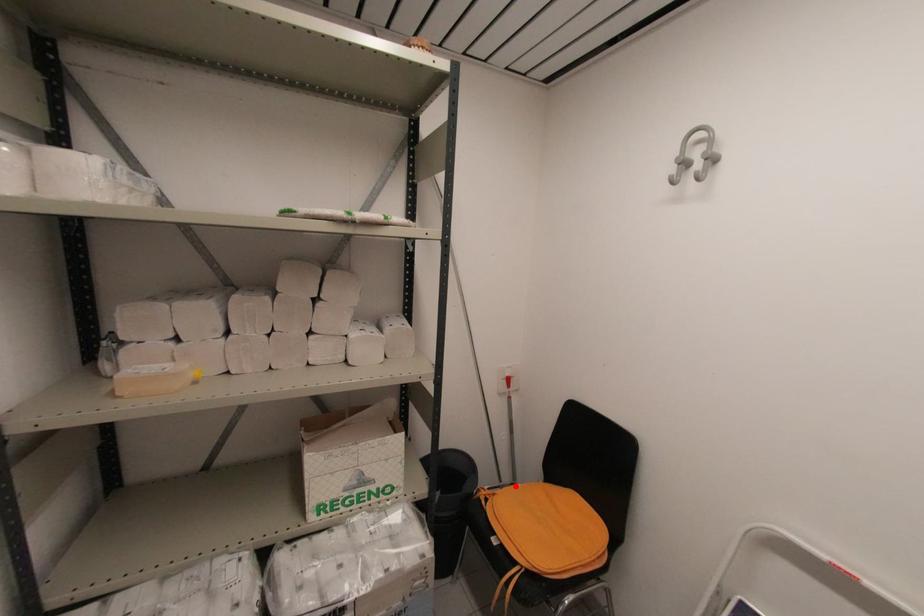
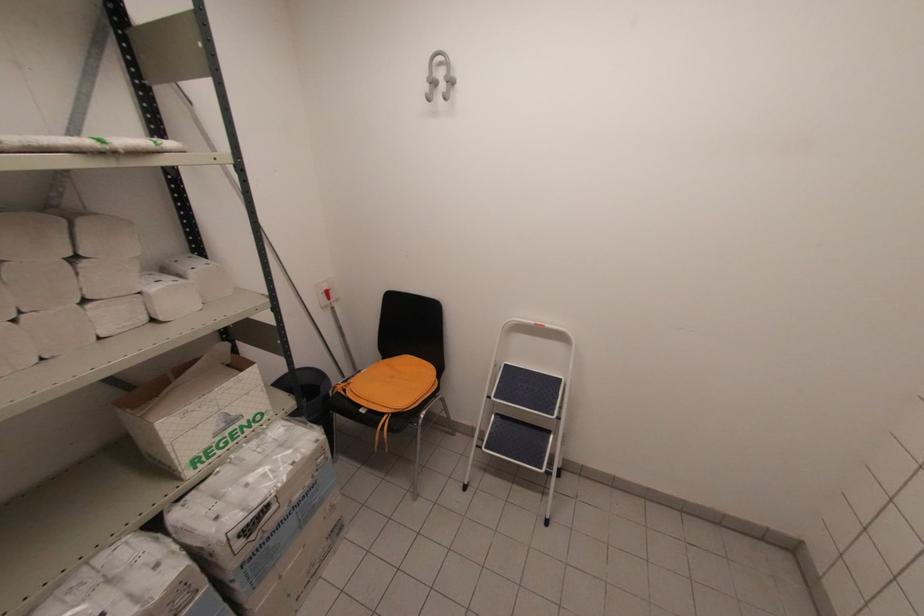
The point at the highlighted location is marked in the first image. Where is the corresponding point in the second image?

(362, 371)